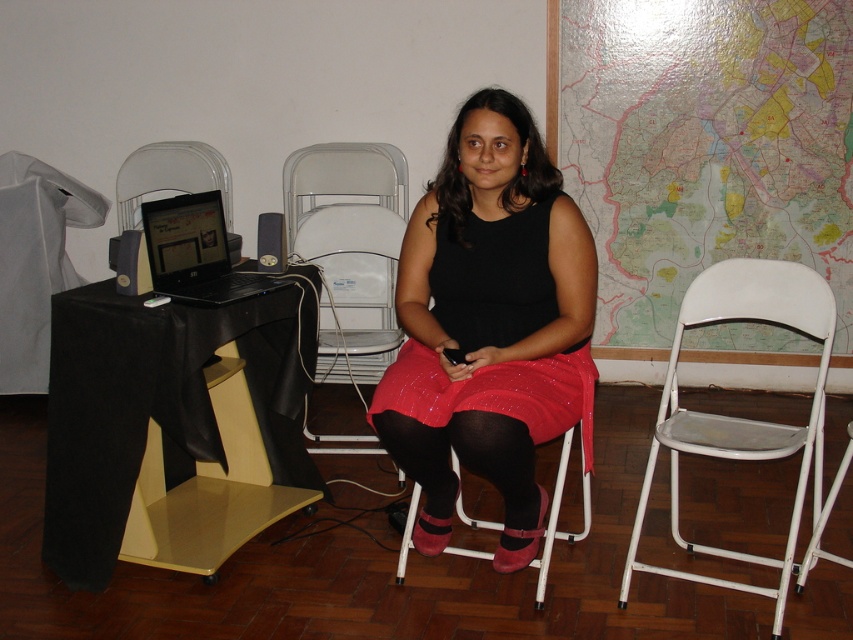
Question: Which object appears closest to the camera in this image?

Choices:
 (A) white plastic chair at right
 (B) matte black laptop at left
 (C) matte black dress at center
 (D) pink fabric stool at center

Answer: (C)

Question: Among these objects, which one is nearest to the camera?

Choices:
 (A) pink fabric stool at center
 (B) matte black laptop at left
 (C) white plastic chair at right
 (D) matte black dress at center

Answer: (D)

Question: Is matte black dress at center further to the viewer compared to pink fabric stool at center?

Choices:
 (A) yes
 (B) no

Answer: (B)

Question: Which point is farther to the camera?

Choices:
 (A) pink fabric stool at center
 (B) matte black dress at center
 (C) matte black laptop at left
 (D) white plastic chair at right

Answer: (C)

Question: Is the position of matte black dress at center less distant than that of white plastic chair at right?

Choices:
 (A) no
 (B) yes

Answer: (B)

Question: Can you confirm if matte black dress at center is wider than white plastic chair at right?

Choices:
 (A) yes
 (B) no

Answer: (B)